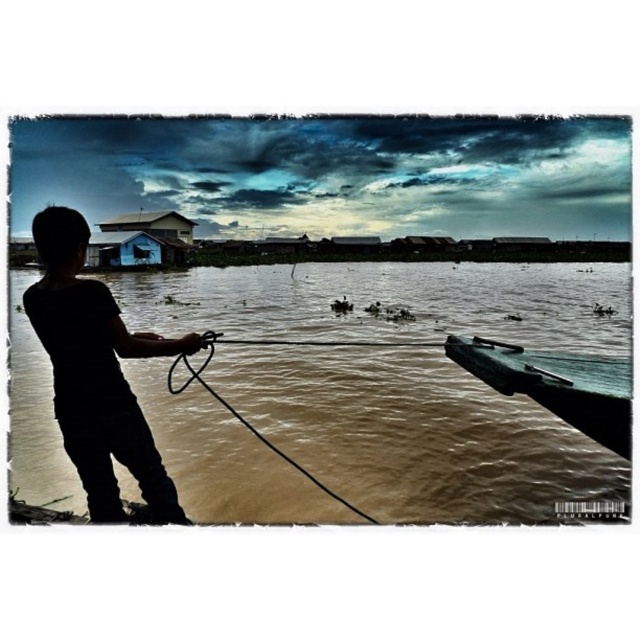
Consider the image. You are a rescue worker assessing the flooded area. You see the brown muddy water at lower left and the silhouette boy at left. Which object occupies more horizontal space in the image?

The brown muddy water at lower left has a greater width than the silhouette boy at left, so it occupies more horizontal space.

You are a rescue worker trying to reach the small boat in the flooded area. You see the brown muddy water at lower left and the green matte boat at lower right. Which object takes up more space in the image?

The brown muddy water at lower left is bigger than the green matte boat at lower right, so it takes up more space in the image.

You are a rescue worker trying to secure the small boat to the shore. You see the black rubber rope at lower center and the brown muddy water at lower left. Which object is closer to you as you stand on the shore?

The brown muddy water at lower left is closer to you because the black rubber rope at lower center is behind it.